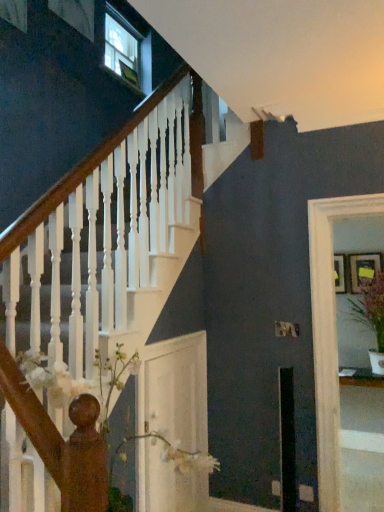
Question: Is clear glass door at right, the 2th glass door viewed from the left, aimed at green leafy plant in white pot at right?

Choices:
 (A) no
 (B) yes

Answer: (B)

Question: From the image's perspective, would you say clear glass door at right, the 1th glass door viewed from the right, is shown under green leafy plant in white pot at right?

Choices:
 (A) no
 (B) yes

Answer: (B)

Question: Would you consider clear glass door at right, the 1th glass door viewed from the right, to be distant from green leafy plant in white pot at right?

Choices:
 (A) yes
 (B) no

Answer: (A)

Question: From a real-world perspective, is clear glass door at right, the 2th glass door viewed from the left, positioned under green leafy plant in white pot at right based on gravity?

Choices:
 (A) no
 (B) yes

Answer: (B)

Question: Is clear glass door at right, the 2th glass door viewed from the left, taller than green leafy plant in white pot at right?

Choices:
 (A) no
 (B) yes

Answer: (B)

Question: Are clear glass door at right, the 2th glass door viewed from the left, and green leafy plant in white pot at right making contact?

Choices:
 (A) yes
 (B) no

Answer: (B)

Question: From a real-world perspective, is wooden picture frame at upper right, the 1th picture frame from the right, over clear glass door at right, the 2th glass door viewed from the left?

Choices:
 (A) yes
 (B) no

Answer: (A)

Question: From the image's perspective, would you say wooden picture frame at upper right, the 2th picture frame from the left, is shown under clear glass door at right, the 1th glass door viewed from the right?

Choices:
 (A) yes
 (B) no

Answer: (B)

Question: Is wooden picture frame at upper right, the 1th picture frame from the right, shorter than clear glass door at right, the 1th glass door viewed from the right?

Choices:
 (A) yes
 (B) no

Answer: (A)

Question: Is wooden picture frame at upper right, the 2th picture frame from the left, oriented towards clear glass door at right, the 1th glass door viewed from the right?

Choices:
 (A) yes
 (B) no

Answer: (A)

Question: From the image's perspective, is wooden picture frame at upper right, the 1th picture frame from the right, located above clear glass door at right, the 2th glass door viewed from the left?

Choices:
 (A) yes
 (B) no

Answer: (A)

Question: Does wooden picture frame at upper right, the 2th picture frame from the left, have a smaller size compared to clear glass door at right, the 2th glass door viewed from the left?

Choices:
 (A) no
 (B) yes

Answer: (B)

Question: Is wooden picture frame at right, the second picture frame in the right-to-left sequence, oriented away from wooden picture frame at upper right, the 2th picture frame from the left?

Choices:
 (A) yes
 (B) no

Answer: (B)